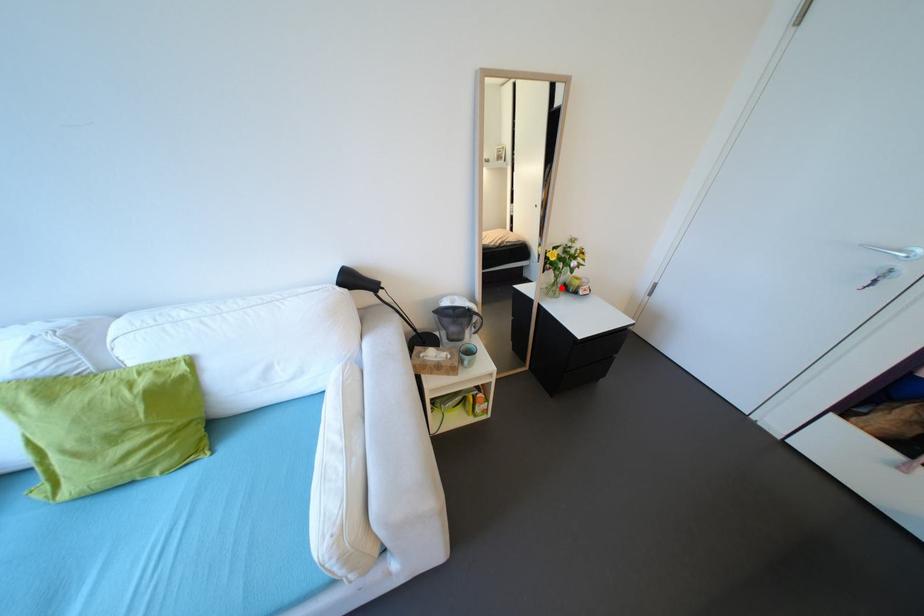
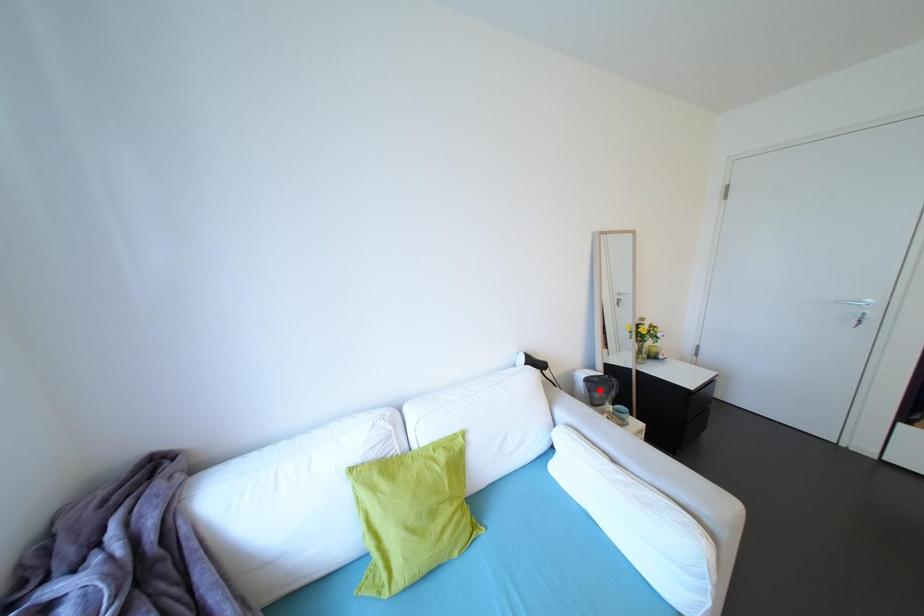
I am providing you with two images of the same scene from different viewpoints. A red point is marked on the first image and another point is marked on the second image. Does the point marked in image1 correspond to the same location as the one in image2?

No